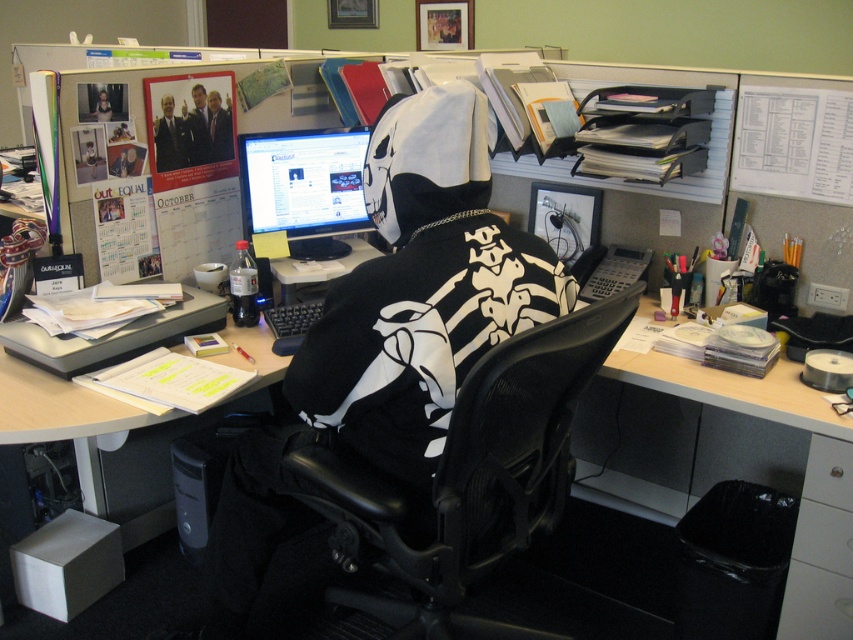
You are an office worker needing to move a box from the desk to the floor. The box is currently placed between the black mesh swivel chair at center and the metallic silver drawer at lower right. Which object will the box be closer to after moving it straight down to the floor?

The box will be closer to the metallic silver drawer at lower right because the black mesh swivel chair at center is wider than the metallic silver drawer at lower right, so the chair occupies more space horizontally, making the drawer closer to the floor area directly below the box.

You are standing in front of the desk in the office cubicle. There are two points marked on the desk surface at coordinates point (827, 545) and point (824, 536). Which point is closer to you?

Point (824, 536) is closer to you because it is nearer to the camera compared to point (827, 545), which is further away.